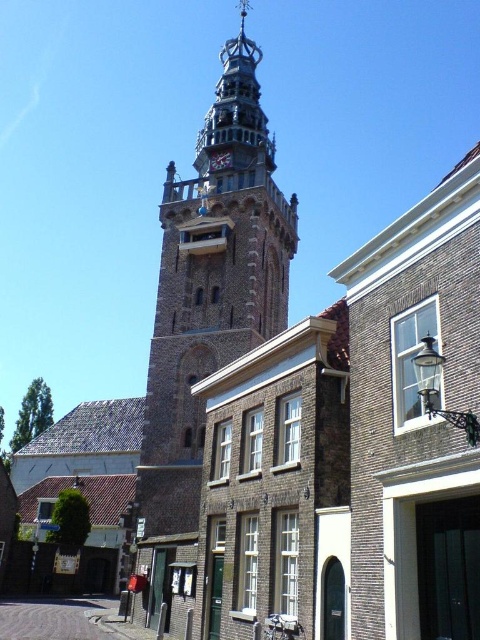
You are an architect designing a new town square and want to ensure proper spacing between the stone clock tower at center and the polished brass clock at center. Based on the image, which object is wider so that you can plan the layout accordingly?

The stone clock tower at center is wider than the polished brass clock at center, so you should allocate more space for the stone clock tower at center in your layout.

Based on the photo, you are an architect visiting the historic town and notice the stone clock tower at center and the polished brass clock at center. Which structure would require more materials to construct due to its size?

The stone clock tower at center is bigger than the polished brass clock at center, so it would require more materials to construct due to its larger size.

You are standing in the historic town square and notice two landmarks. You see the stone clock tower at center and the polished brass clock at center. Which one is positioned to the right of the other?

The stone clock tower at center is positioned to the right of the polished brass clock at center.